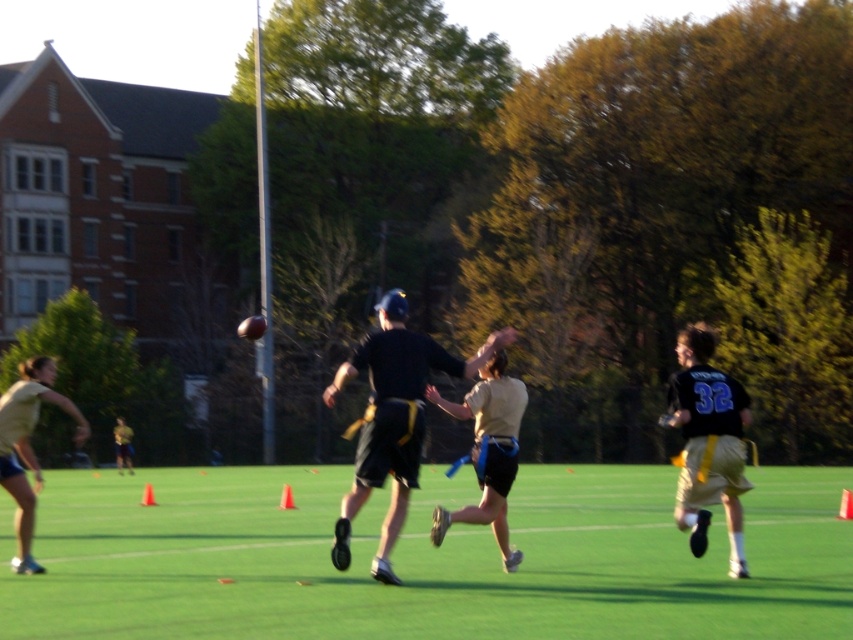
Is green artificial turf at center thinner than tan fabric jersey at center?

Incorrect, green artificial turf at center's width is not less than tan fabric jersey at center's.

Is green artificial turf at center to the right of tan fabric jersey at center from the viewer's perspective?

No, green artificial turf at center is not to the right of tan fabric jersey at center.

Between point (215, 529) and point (498, 452), which one is positioned in front?

Point (498, 452) is more forward.

At what (x,y) coordinates should I click in order to perform the action: click on green artificial turf at center. Please return your answer as a coordinate pair (x, y). This screenshot has height=640, width=853. Looking at the image, I should click on (424, 557).

Does green artificial turf at center have a greater width compared to black jersey at right?

Yes.

What do you see at coordinates (424, 557) in the screenshot?
I see `green artificial turf at center` at bounding box center [424, 557].

Locate an element on the screen. The height and width of the screenshot is (640, 853). green artificial turf at center is located at coordinates (424, 557).

Between black fabric shorts at center and tan fabric jersey at center, which one appears on the left side from the viewer's perspective?

Positioned to the left is black fabric shorts at center.

Is black fabric shorts at center positioned before tan fabric jersey at center?

Yes, black fabric shorts at center is in front of tan fabric jersey at center.

Who is more forward, (387, 515) or (486, 445)?

Positioned in front is point (387, 515).

Find the location of `black fabric shorts at center`. black fabric shorts at center is located at coordinates (393, 419).